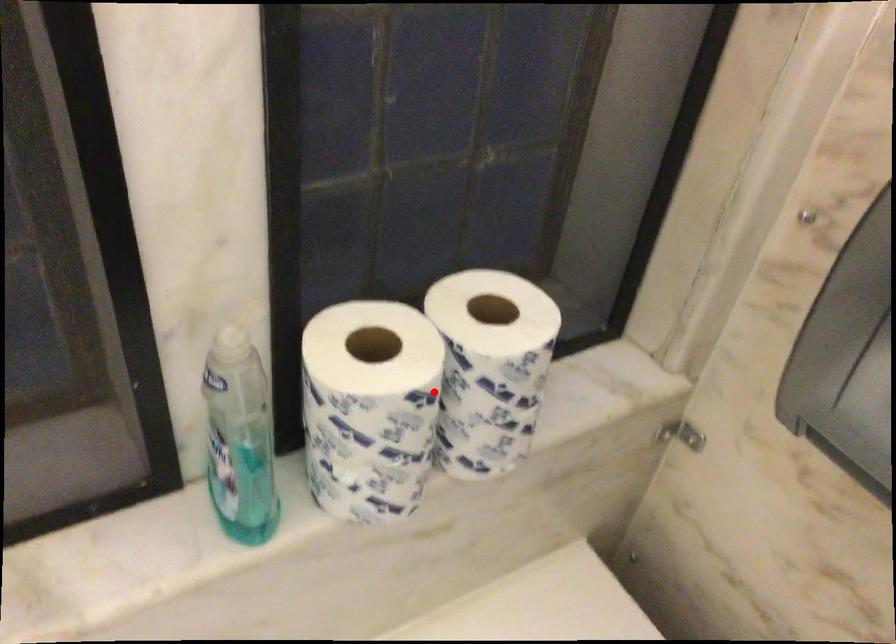
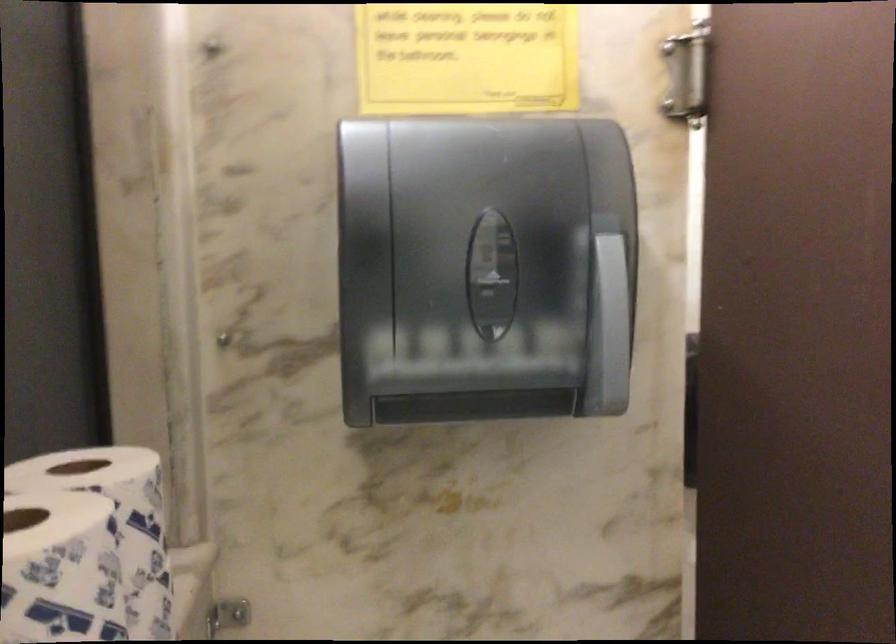
Question: I am providing you with two images of the same scene from different viewpoints. A red point is marked on the first image. At the location where the point appears in image 1, is it still visible in image 2?

Choices:
 (A) Yes
 (B) No

Answer: (A)